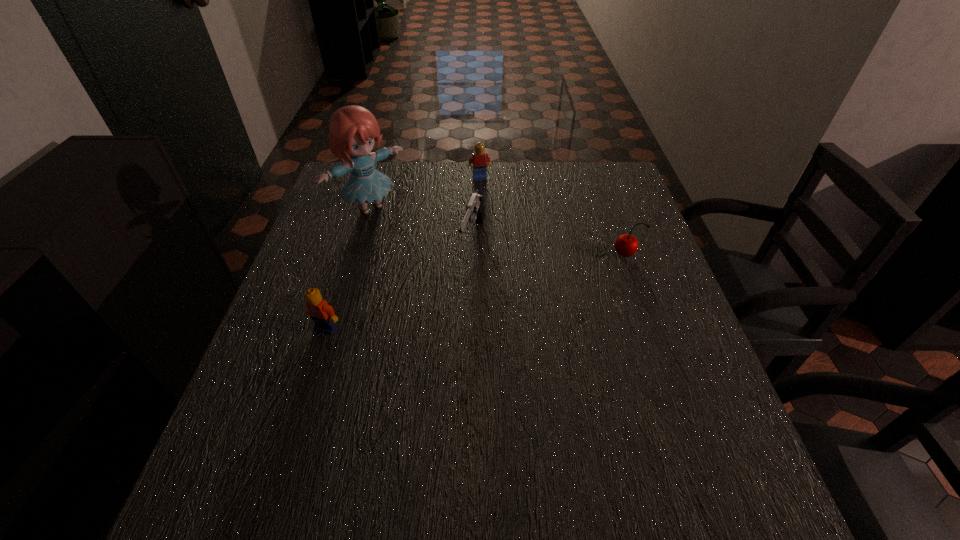
You are a GUI agent. You are given a task and a screenshot of the screen. Output one action in this format:
    pyautogui.click(x=<x>, y=<y>)
    Task: Click on the free region located on the front-facing side of the right Lego
    The image size is (960, 540).
    Given the screenshot: What is the action you would take?
    pyautogui.click(x=493, y=226)

Identify the location of vacant space located on the front-facing side of the right Lego. (495, 231).

You are a GUI agent. You are given a task and a screenshot of the screen. Output one action in this format:
    pyautogui.click(x=<x>, y=<y>)
    Task: Click on the free region located at the muzzle of the gun
    
    Given the screenshot: What is the action you would take?
    pyautogui.click(x=450, y=327)

You are a GUI agent. You are given a task and a screenshot of the screen. Output one action in this format:
    pyautogui.click(x=<x>, y=<y>)
    Task: Click on the free space located at the muzzle of the gun
    This screenshot has width=960, height=540.
    Given the screenshot: What is the action you would take?
    pyautogui.click(x=432, y=381)

This screenshot has width=960, height=540. Identify the location of vacant point located 0.140m at the muzzle of the gun. (457, 307).

Image resolution: width=960 pixels, height=540 pixels. Identify the location of vacant area located on the front-facing side of the tallest object. (404, 234).

You are a GUI agent. You are given a task and a screenshot of the screen. Output one action in this format:
    pyautogui.click(x=<x>, y=<y>)
    Task: Click on the free space located on the front-facing side of the tallest object
    Image resolution: width=960 pixels, height=540 pixels.
    Given the screenshot: What is the action you would take?
    pyautogui.click(x=410, y=240)

Where is `free space located on the front-facing side of the tallest object`? This screenshot has width=960, height=540. free space located on the front-facing side of the tallest object is located at coordinates (444, 269).

Where is `Lego that is at the far edge`? Image resolution: width=960 pixels, height=540 pixels. Lego that is at the far edge is located at coordinates (480, 160).

Find the location of a particular element. This screenshot has height=540, width=960. doll situated at the far edge is located at coordinates (353, 130).